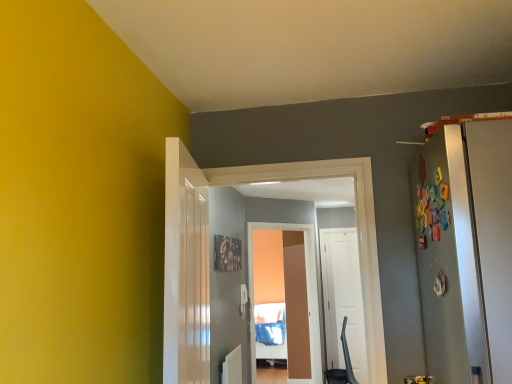
Question: From a real-world perspective, does white glossy door at center, placed as the second door when sorted from front to back, stand above white matte door at center, the 1th door in the right-to-left sequence?

Choices:
 (A) yes
 (B) no

Answer: (A)

Question: Can you confirm if white glossy door at center, which is counted as the second door, starting from the right, is bigger than white matte door at center, the 1th door positioned from the back?

Choices:
 (A) no
 (B) yes

Answer: (B)

Question: Is white glossy door at center, the 2th door from the left, facing away from white matte door at center, the 1th door in the right-to-left sequence?

Choices:
 (A) yes
 (B) no

Answer: (A)

Question: Can you confirm if white glossy door at center, which is counted as the second door, starting from the right, is shorter than white matte door at center, the 3th door positioned from the left?

Choices:
 (A) no
 (B) yes

Answer: (B)

Question: Is white glossy door at center, the 2th door from the left, directly adjacent to white matte door at center, the 3th door positioned from the left?

Choices:
 (A) yes
 (B) no

Answer: (B)

Question: From their relative heights in the image, would you say white glossy door at center, the third door from the back, is taller or shorter than matte brown screen door at center?

Choices:
 (A) short
 (B) tall

Answer: (A)

Question: Is white glossy door at center, which is counted as the first door, starting from the front, situated inside matte brown screen door at center or outside?

Choices:
 (A) outside
 (B) inside

Answer: (A)

Question: Considering the positions of point (207, 271) and point (249, 324), is point (207, 271) closer or farther from the camera than point (249, 324)?

Choices:
 (A) closer
 (B) farther

Answer: (A)

Question: From a real-world perspective, is white glossy door at center, the third door from the back, above or below matte brown screen door at center?

Choices:
 (A) below
 (B) above

Answer: (B)

Question: From a real-world perspective, relative to white matte door at center, placed as the 3th door when sorted from front to back, is white glossy door at center, which is counted as the 2th door, starting from the back, vertically above or below?

Choices:
 (A) below
 (B) above

Answer: (B)

Question: From the image's perspective, is white glossy door at center, which is counted as the second door, starting from the right, located above or below white matte door at center, the 3th door positioned from the left?

Choices:
 (A) below
 (B) above

Answer: (B)

Question: Considering the positions of white glossy door at center, placed as the second door when sorted from front to back, and white matte door at center, the 1th door in the right-to-left sequence, in the image, is white glossy door at center, placed as the second door when sorted from front to back, taller or shorter than white matte door at center, the 1th door in the right-to-left sequence,?

Choices:
 (A) short
 (B) tall

Answer: (A)

Question: Is white glossy door at center, the 2th door from the left, situated inside white matte door at center, the 1th door in the right-to-left sequence, or outside?

Choices:
 (A) inside
 (B) outside

Answer: (B)

Question: In terms of height, does white glossy door at center, which is counted as the first door, starting from the front, look taller or shorter compared to white matte door at center, the 1th door in the right-to-left sequence?

Choices:
 (A) tall
 (B) short

Answer: (B)

Question: From the image's perspective, is white glossy door at center, the third door from the back, positioned above or below white matte door at center, the 1th door in the right-to-left sequence?

Choices:
 (A) above
 (B) below

Answer: (A)